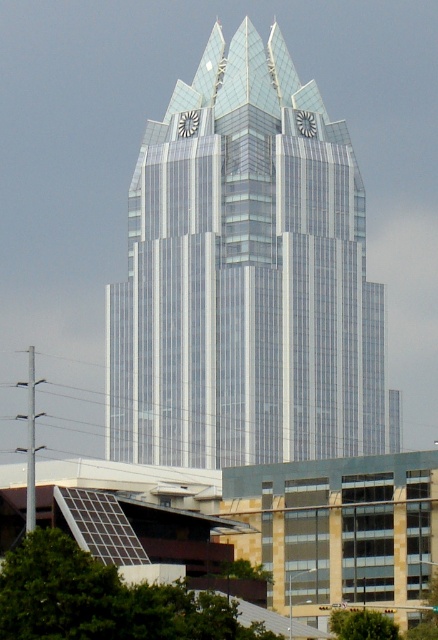
Question: Can you confirm if transparent glass skyscraper at center is wider than green leafy tree at lower center?

Choices:
 (A) yes
 (B) no

Answer: (A)

Question: Considering the relative positions of transparent glass skyscraper at center and green leafy tree at lower left in the image provided, where is transparent glass skyscraper at center located with respect to green leafy tree at lower left?

Choices:
 (A) below
 (B) above

Answer: (B)

Question: Does green leafy tree at lower left appear on the left side of green leafy tree at lower center?

Choices:
 (A) no
 (B) yes

Answer: (B)

Question: Among these points, which one is nearest to the camera?

Choices:
 (A) (46, 595)
 (B) (359, 413)
 (C) (373, 624)

Answer: (A)

Question: Which point is closer to the camera?

Choices:
 (A) transparent glass skyscraper at center
 (B) green leafy tree at lower left

Answer: (B)

Question: Which of the following is the closest to the observer?

Choices:
 (A) (120, 637)
 (B) (293, 67)
 (C) (339, 628)

Answer: (A)